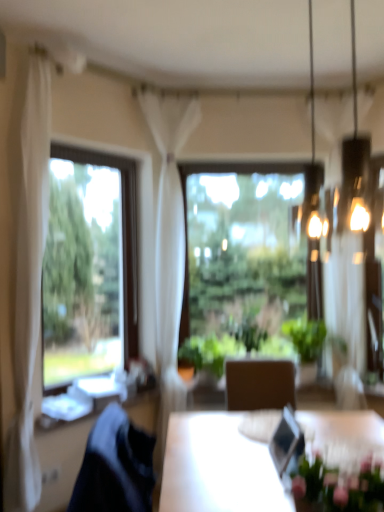
Question: Would you say transparent glass window at center, placed as the 1th window when sorted from back to front, is outside pink matte floral arrangement at lower right?

Choices:
 (A) no
 (B) yes

Answer: (B)

Question: Does transparent glass window at center, the 2th window viewed from the front, touch pink matte floral arrangement at lower right?

Choices:
 (A) no
 (B) yes

Answer: (A)

Question: From a real-world perspective, is transparent glass window at center, marked as the first window in a right-to-left arrangement, on top of pink matte floral arrangement at lower right?

Choices:
 (A) yes
 (B) no

Answer: (A)

Question: Considering the relative positions of transparent glass window at center, placed as the 1th window when sorted from back to front, and pink matte floral arrangement at lower right in the image provided, is transparent glass window at center, placed as the 1th window when sorted from back to front, to the right of pink matte floral arrangement at lower right from the viewer's perspective?

Choices:
 (A) no
 (B) yes

Answer: (B)

Question: Is transparent glass window at center, the 2th window viewed from the front, taller than pink matte floral arrangement at lower right?

Choices:
 (A) no
 (B) yes

Answer: (B)

Question: In the image, is transparent glass window at center, marked as the first window in a right-to-left arrangement, positioned in front of or behind metallic glass chandelier at upper right?

Choices:
 (A) front
 (B) behind

Answer: (B)

Question: From the image's perspective, is transparent glass window at center, which appears as the 2th window when viewed from the left, located above or below metallic glass chandelier at upper right?

Choices:
 (A) below
 (B) above

Answer: (A)

Question: Is transparent glass window at center, the 2th window viewed from the front, taller or shorter than metallic glass chandelier at upper right?

Choices:
 (A) tall
 (B) short

Answer: (A)

Question: Considering the positions of point (187, 353) and point (309, 86), is point (187, 353) closer or farther from the camera than point (309, 86)?

Choices:
 (A) farther
 (B) closer

Answer: (B)

Question: Considering the positions of point (299, 489) and point (195, 295), is point (299, 489) closer or farther from the camera than point (195, 295)?

Choices:
 (A) closer
 (B) farther

Answer: (A)

Question: From the image's perspective, relative to transparent glass window at center, which appears as the 2th window when viewed from the left, is pink matte floral arrangement at lower right above or below?

Choices:
 (A) below
 (B) above

Answer: (A)

Question: Relative to transparent glass window at center, which appears as the 2th window when viewed from the left, is pink matte floral arrangement at lower right in front or behind?

Choices:
 (A) behind
 (B) front

Answer: (B)

Question: Is pink matte floral arrangement at lower right inside the boundaries of transparent glass window at center, which appears as the 2th window when viewed from the left, or outside?

Choices:
 (A) outside
 (B) inside

Answer: (A)

Question: Would you say white sheer curtain at left, which is the second curtain from right to left, is to the left or to the right of clear glass window at left, the 1th window viewed from the front, in the picture?

Choices:
 (A) left
 (B) right

Answer: (A)

Question: In the image, is white sheer curtain at left, acting as the 1th curtain starting from the left, positioned in front of or behind clear glass window at left, the 2th window positioned from the back?

Choices:
 (A) behind
 (B) front

Answer: (B)